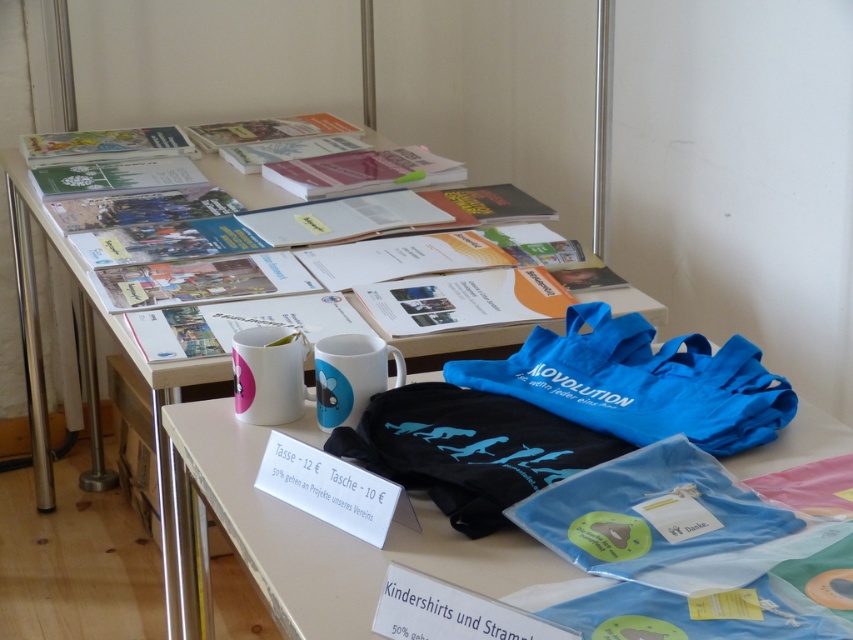
Question: Which point is farther from the camera taking this photo?

Choices:
 (A) (383, 401)
 (B) (210, 161)
 (C) (267, 371)
 (D) (558, 362)

Answer: (B)

Question: Does black fabric bag at center come in front of white glossy mug at upper center?

Choices:
 (A) yes
 (B) no

Answer: (A)

Question: Can you confirm if blue fabric bag at lower center is wider than blue fabric bag at center right?

Choices:
 (A) no
 (B) yes

Answer: (B)

Question: Estimate the real-world distances between objects in this image. Which object is farther from the blue fabric bag at center right?

Choices:
 (A) blue fabric bag at lower center
 (B) black fabric bag at center
 (C) white glossy mug at center

Answer: (A)

Question: Does blue fabric bag at lower right have a greater width compared to matte paper magazine at upper center?

Choices:
 (A) no
 (B) yes

Answer: (A)

Question: Which object is farther from the camera taking this photo?

Choices:
 (A) matte paper magazine at upper center
 (B) white glossy mug at upper center

Answer: (A)